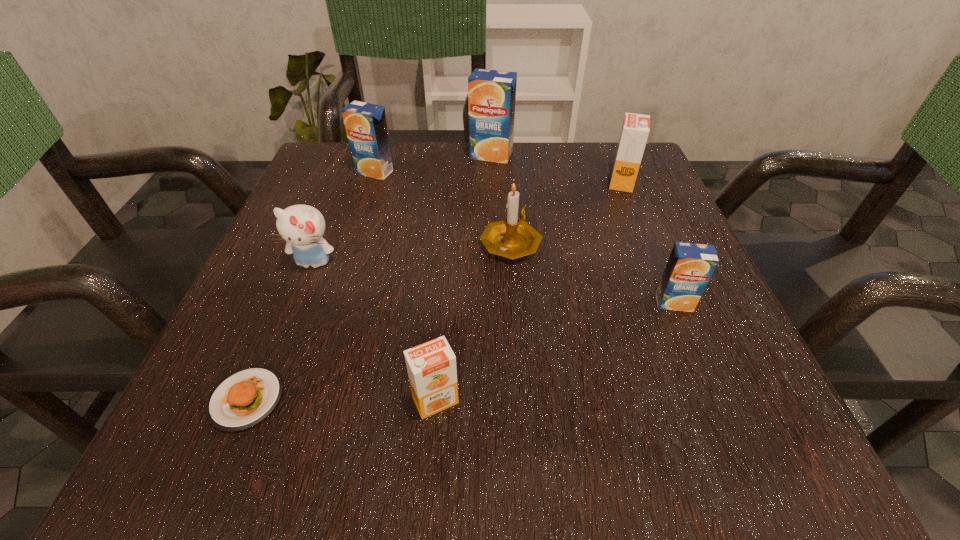
Locate an element on the screen. Image resolution: width=960 pixels, height=540 pixels. free space that satisfies the following two spatial constraints: 1. on the back side of the sixth farthest object; 2. on the left side of the second orange juice from left to right is located at coordinates (444, 302).

Find the location of a particular element. The width and height of the screenshot is (960, 540). vacant region that satisfies the following two spatial constraints: 1. on the front side of the third orange juice from right to left; 2. on the left side of the sixth farthest object is located at coordinates (496, 302).